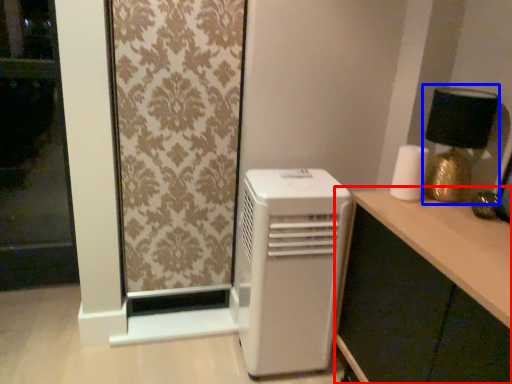
Question: Among these objects, which one is farthest to the camera, computer desk (highlighted by a red box) or table lamp (highlighted by a blue box)?

Choices:
 (A) computer desk
 (B) table lamp

Answer: (B)